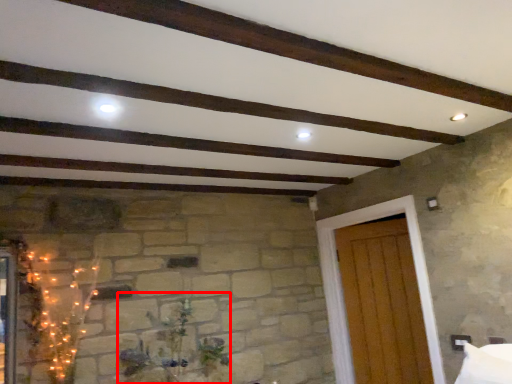
Question: From the image's perspective, what is the correct spatial positioning of plant (annotated by the red box) in reference to door?

Choices:
 (A) below
 (B) above

Answer: (A)